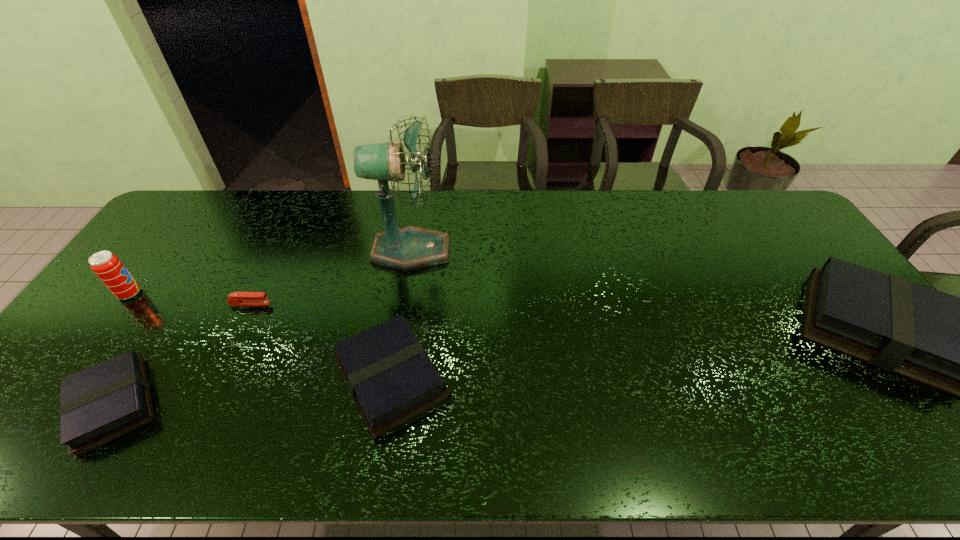
Where is `vacant space located on the back of the fourth tallest object`? Image resolution: width=960 pixels, height=540 pixels. vacant space located on the back of the fourth tallest object is located at coordinates (415, 232).

You are a GUI agent. You are given a task and a screenshot of the screen. Output one action in this format:
    pyautogui.click(x=<x>, y=<y>)
    Task: Click on the vacant space located on the front-facing side of the stapler
    The height and width of the screenshot is (540, 960).
    Given the screenshot: What is the action you would take?
    pyautogui.click(x=378, y=303)

This screenshot has width=960, height=540. I want to click on vacant space situated 0.270m in front of the fan where the wind blows, so click(x=535, y=251).

Find the location of `free space located on the right of the soda can`. free space located on the right of the soda can is located at coordinates (172, 294).

The image size is (960, 540). Identify the location of object that is at the far edge. (409, 248).

I want to click on book situated at the left edge, so pyautogui.click(x=99, y=404).

The width and height of the screenshot is (960, 540). I want to click on soda can that is at the left edge, so click(107, 266).

Where is `object present at the near left corner`? This screenshot has height=540, width=960. object present at the near left corner is located at coordinates tap(99, 404).

Locate an element on the screen. The width and height of the screenshot is (960, 540). free space at the far edge of the desktop is located at coordinates (331, 207).

Where is `free location at the left edge of the desktop`? free location at the left edge of the desktop is located at coordinates (171, 236).